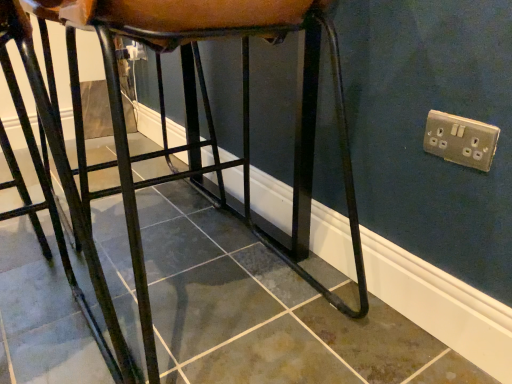
What do you see at coordinates (187, 133) in the screenshot?
I see `matte black stool at center` at bounding box center [187, 133].

Measure the distance between point (329,42) and camera.

Point (329,42) and camera are 31.89 inches apart.

Find the location of a particular element. Image resolution: width=512 pixels, height=384 pixels. matte black stool at center is located at coordinates (187, 133).

Describe the element at coordinates (460, 140) in the screenshot. I see `silver metallic socket at upper right` at that location.

Image resolution: width=512 pixels, height=384 pixels. What are the coordinates of `silver metallic socket at upper right` in the screenshot? It's located at (460, 140).

What is the approximate width of silver metallic socket at upper right?

silver metallic socket at upper right is 0.50 inches in width.

The height and width of the screenshot is (384, 512). I want to click on matte black stool at center, so click(x=187, y=133).

Which object is positioned more to the left, silver metallic socket at upper right or matte black stool at center?

Positioned to the left is matte black stool at center.

Considering the relative positions of silver metallic socket at upper right and matte black stool at center in the image provided, is silver metallic socket at upper right in front of matte black stool at center?

No, silver metallic socket at upper right is further to the viewer.

Which is nearer, (x=434, y=122) or (x=208, y=12)?

Point (x=434, y=122) is farther from the camera than point (x=208, y=12).

In the scene shown: From the image's perspective, which object appears higher, silver metallic socket at upper right or matte black stool at center?

matte black stool at center, from the image's perspective.

From a real-world perspective, between silver metallic socket at upper right and matte black stool at center, who is vertically lower?

From a 3D spatial view, matte black stool at center is below.

Between silver metallic socket at upper right and matte black stool at center, which one has smaller width?

Thinner between the two is silver metallic socket at upper right.

Which of these two, silver metallic socket at upper right or matte black stool at center, stands taller?

matte black stool at center is taller.

Between silver metallic socket at upper right and matte black stool at center, which one has larger size?

With larger size is matte black stool at center.

Would you say silver metallic socket at upper right is inside or outside matte black stool at center?

silver metallic socket at upper right lies outside matte black stool at center.

Is silver metallic socket at upper right with matte black stool at center?

They are not placed beside each other.

Could you tell me if silver metallic socket at upper right is facing matte black stool at center?

No, silver metallic socket at upper right is not turned towards matte black stool at center.

From the picture: How different are the orientations of silver metallic socket at upper right and matte black stool at center in degrees?

There is a 0.289-degree angle between the facing directions of silver metallic socket at upper right and matte black stool at center.

Identify the location of furniture on the left of silver metallic socket at upper right. Image resolution: width=512 pixels, height=384 pixels. (187, 133).

Which object is positioned more to the left, matte black stool at center or silver metallic socket at upper right?

matte black stool at center.

Which object is more forward, matte black stool at center or silver metallic socket at upper right?

matte black stool at center.

Which point is more forward, (264, 23) or (488, 124)?

The point (264, 23) is closer to the camera.

From the image's perspective, which is below, matte black stool at center or silver metallic socket at upper right?

silver metallic socket at upper right, from the image's perspective.

From a real-world perspective, is matte black stool at center on silver metallic socket at upper right?

No, from a real-world perspective, matte black stool at center is not on top of silver metallic socket at upper right.

Considering the sizes of matte black stool at center and silver metallic socket at upper right in the image, is matte black stool at center wider or thinner than silver metallic socket at upper right?

In the image, matte black stool at center appears to be wider than silver metallic socket at upper right.

Which of these two, matte black stool at center or silver metallic socket at upper right, stands shorter?

silver metallic socket at upper right.

Between matte black stool at center and silver metallic socket at upper right, which one has smaller size?

With smaller size is silver metallic socket at upper right.

Is silver metallic socket at upper right surrounded by matte black stool at center?

Actually, silver metallic socket at upper right is outside matte black stool at center.

Is there a large distance between matte black stool at center and silver metallic socket at upper right?

No, matte black stool at center is in close proximity to silver metallic socket at upper right.

Is matte black stool at center looking in the opposite direction of silver metallic socket at upper right?

matte black stool at center is not turned away from silver metallic socket at upper right.

Locate an element on the screen. electric outlet that is on the right side of matte black stool at center is located at coordinates (460, 140).

You are a GUI agent. You are given a task and a screenshot of the screen. Output one action in this format:
    pyautogui.click(x=<x>, y=<y>)
    Task: Click on the electric outlet above the matte black stool at center (from a real-world perspective)
    
    Given the screenshot: What is the action you would take?
    pyautogui.click(x=460, y=140)

This screenshot has width=512, height=384. I want to click on furniture that appears on the left of silver metallic socket at upper right, so click(187, 133).